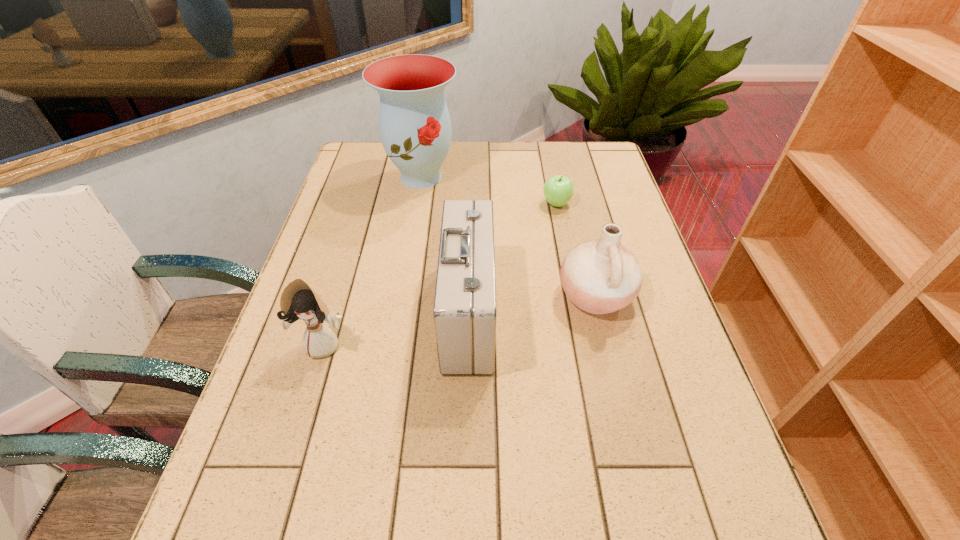
Locate an element on the screen. Image resolution: width=960 pixels, height=540 pixels. vacant space positioned 0.130m at the front face of the doll is located at coordinates (302, 417).

I want to click on free space located on the left of the shortest object, so click(446, 204).

The image size is (960, 540). I want to click on object that is at the far edge, so click(x=415, y=128).

The image size is (960, 540). Find the location of `vase that is positioned at the left edge`. vase that is positioned at the left edge is located at coordinates (415, 128).

This screenshot has height=540, width=960. What are the coordinates of `doll that is at the left edge` in the screenshot? It's located at (299, 301).

The width and height of the screenshot is (960, 540). Identify the location of object situated at the right edge. (600, 276).

At what (x,y) coordinates should I click in order to perform the action: click on object that is at the far left corner. Please return your answer as a coordinate pair (x, y). This screenshot has width=960, height=540. Looking at the image, I should click on (415, 128).

You are a GUI agent. You are given a task and a screenshot of the screen. Output one action in this format:
    pyautogui.click(x=<x>, y=<y>)
    Task: Click on the vacant space at the far edge of the desktop
    
    Given the screenshot: What is the action you would take?
    pyautogui.click(x=526, y=177)

You are a GUI agent. You are given a task and a screenshot of the screen. Output one action in this format:
    pyautogui.click(x=<x>, y=<y>)
    Task: Click on the vacant region at the left edge of the desktop
    
    Given the screenshot: What is the action you would take?
    pyautogui.click(x=227, y=517)

In the image, there is a desktop. Identify the location of free space at the right edge. (654, 267).